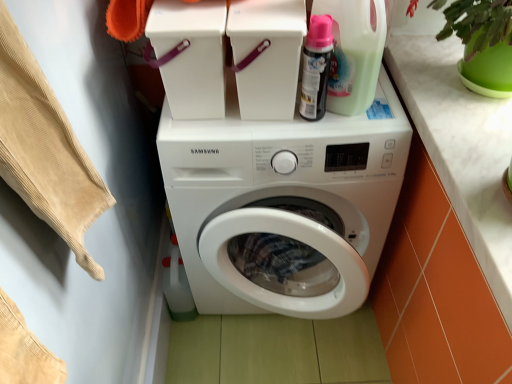
Find the location of a particular element. This screenshot has height=384, width=512. free space above white marble countertop at upper right (from a real-world perspective) is located at coordinates (463, 116).